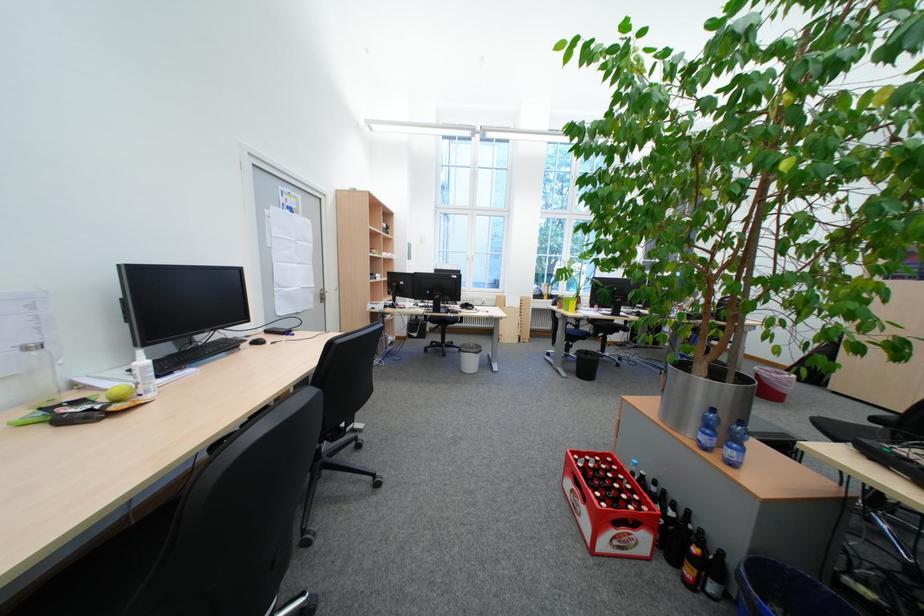
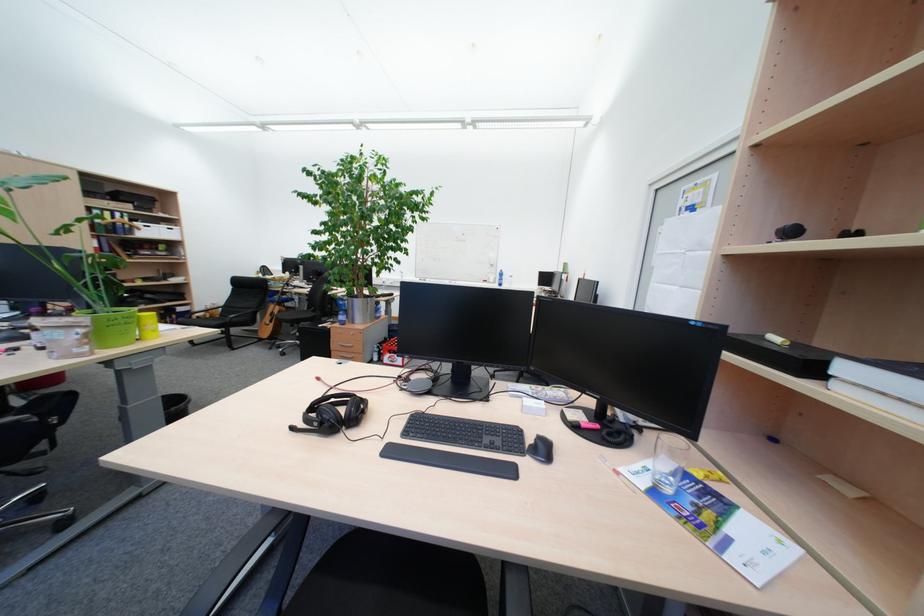
The point at [277,213] is marked in the first image. Where is the corresponding point in the second image?

(671, 230)